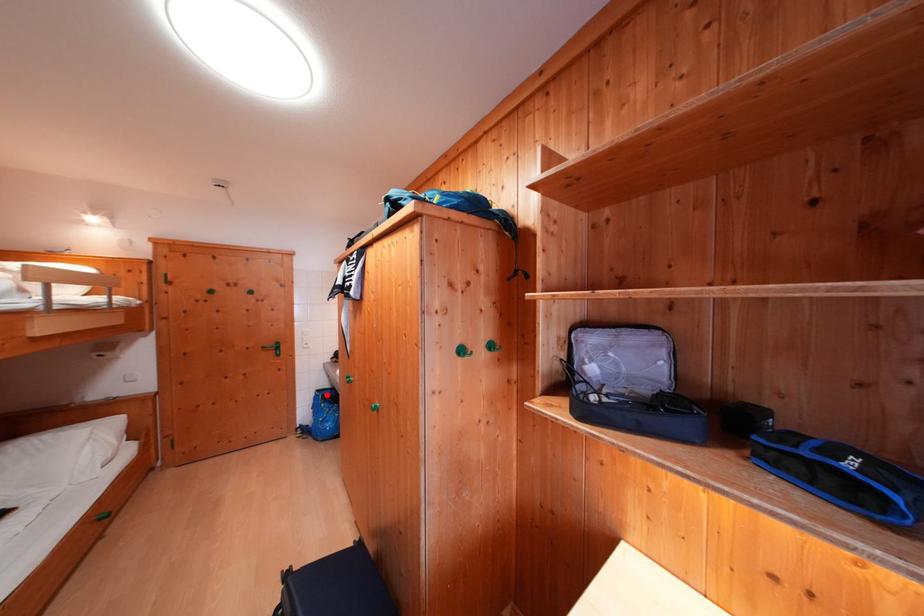
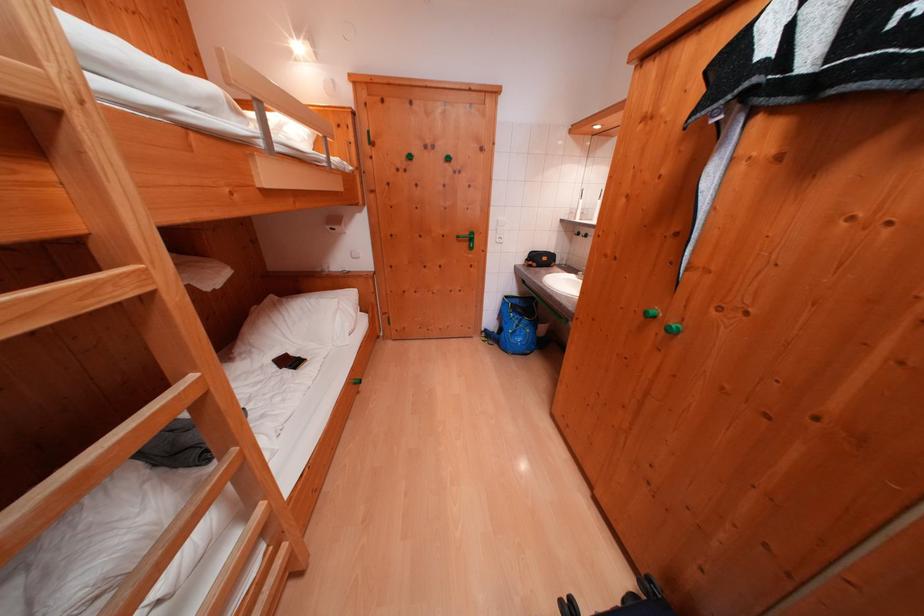
Question: I am providing you with two images of the same scene from different viewpoints. In image1, a red point is highlighted. Considering the same 3D point in image2, which of the following is correct?

Choices:
 (A) It is closer
 (B) It is farther

Answer: (A)